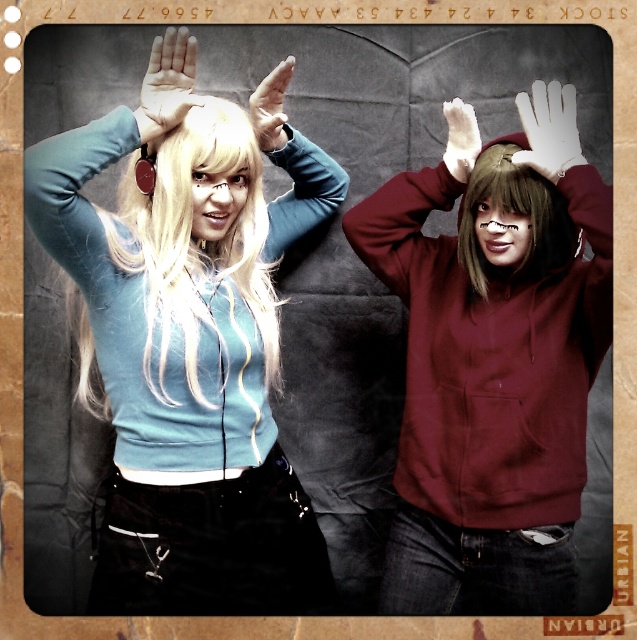
Between dark brown straight hair at upper right and matte black hand at upper left, which one is positioned higher?

matte black hand at upper left is above.

From the picture: Does dark brown straight hair at upper right appear over matte black hand at upper left?

No.

Locate an element on the screen. This screenshot has width=637, height=640. dark brown straight hair at upper right is located at coordinates (515, 212).

Is matte maroon hoodie at center taller than white leather glove at upper center?

Yes, matte maroon hoodie at center is taller than white leather glove at upper center.

Between point (519, 321) and point (547, 138), which one is positioned in front?

Point (547, 138) is more forward.

Is point (440, 492) positioned in front of point (569, 152)?

No.

Locate an element on the screen. The width and height of the screenshot is (637, 640). matte maroon hoodie at center is located at coordinates (490, 378).

Is point (261, 515) less distant than point (196, 360)?

That is False.

Can you confirm if matte blue hoodie at center is smaller than blonde silky hair at left?

No.

Which is behind, point (134, 205) or point (225, 237)?

Positioned behind is point (225, 237).

Identify the location of matte blue hoodie at center. (189, 356).